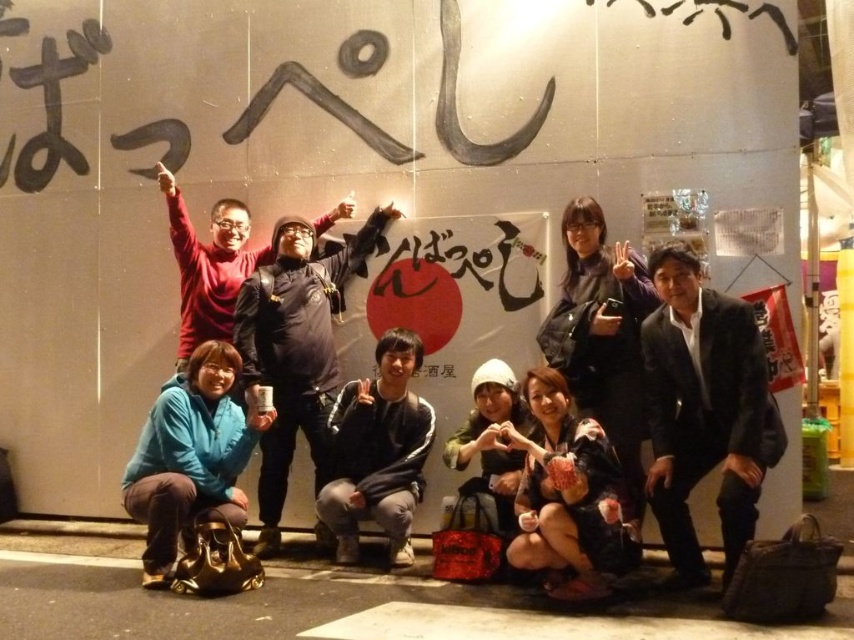
Does black suit at center have a greater width compared to dark blue hoodie at center?

In fact, black suit at center might be narrower than dark blue hoodie at center.

Does black suit at center lie in front of dark blue hoodie at center?

Yes.

The image size is (854, 640). I want to click on black suit at center, so click(x=705, y=412).

Looking at this image, is dark blue jacket at center taller than dark blue hoodie at center?

Correct, dark blue jacket at center is much taller as dark blue hoodie at center.

Is point (256, 352) more distant than point (227, 237)?

No, it is in front of (227, 237).

The height and width of the screenshot is (640, 854). Identify the location of dark blue jacket at center. (295, 352).

Which of these two, black suit at center or dark blue jacket at center, stands taller?

With more height is dark blue jacket at center.

Between point (729, 332) and point (253, 326), which one is positioned behind?

Point (253, 326)

Between point (682, 372) and point (272, 307), which one is positioned in front?

Point (682, 372) is more forward.

Image resolution: width=854 pixels, height=640 pixels. What are the coordinates of `black suit at center` in the screenshot? It's located at (705, 412).